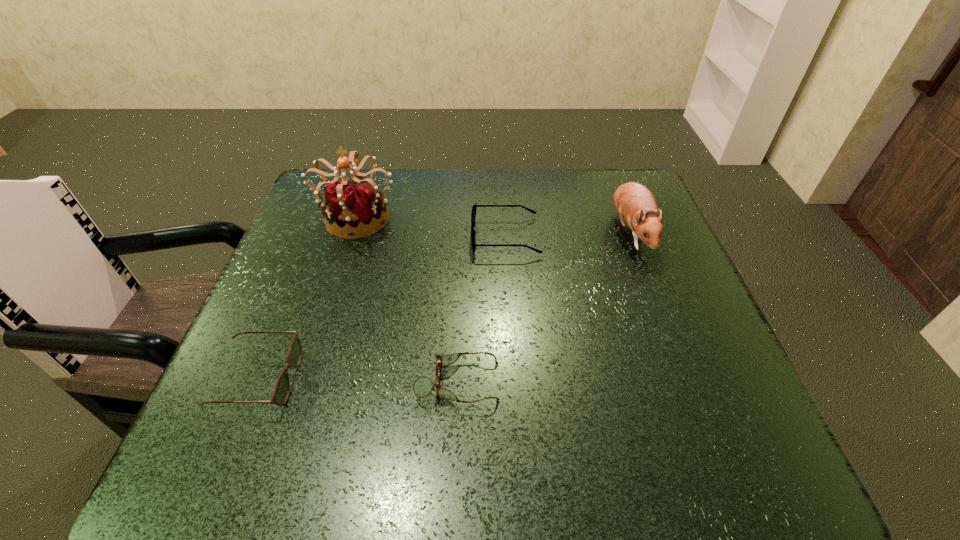
Identify the location of tiara. pos(356,205).

Image resolution: width=960 pixels, height=540 pixels. Find the location of `the rightmost object`. the rightmost object is located at coordinates (635, 204).

Locate an element on the screen. the fourth shortest object is located at coordinates (635, 204).

The height and width of the screenshot is (540, 960). Identify the location of the farthest spectacles. (473, 215).

In order to click on the leftmost spectacles in this screenshot , I will do `click(280, 393)`.

Find the location of a particular element. The height and width of the screenshot is (540, 960). the shortest spectacles is located at coordinates (422, 387).

I want to click on vacant space located on the front-facing side of the tiara, so pyautogui.click(x=307, y=373).

Find the location of a particular element. The image size is (960, 540). vacant space positioned at the face of the second tallest object is located at coordinates (665, 325).

At what (x,y) coordinates should I click in order to perform the action: click on free region located 0.380m on the front-facing side of the farthest spectacles. Please return your answer as a coordinate pair (x, y). The width and height of the screenshot is (960, 540). Looking at the image, I should click on (316, 237).

The height and width of the screenshot is (540, 960). Identify the location of vacant space located 0.090m on the front-facing side of the farthest spectacles. (x=435, y=237).